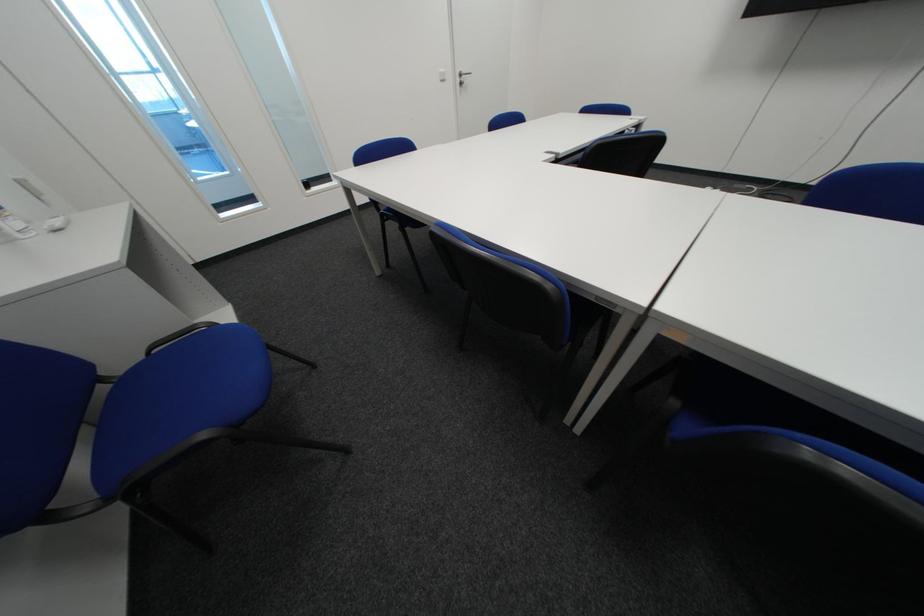
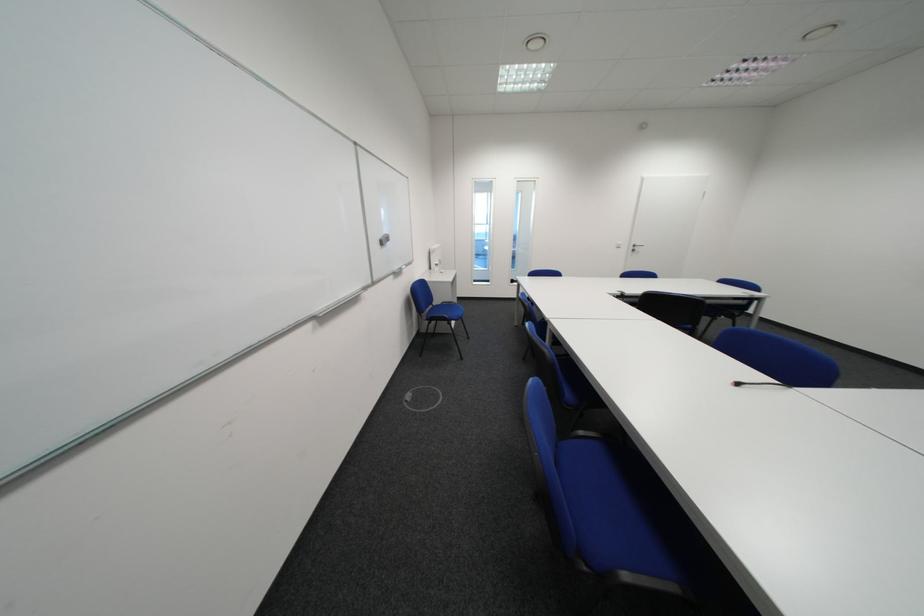
Find the pixel in the second image that matches the point at 454,82 in the first image.

(628, 249)